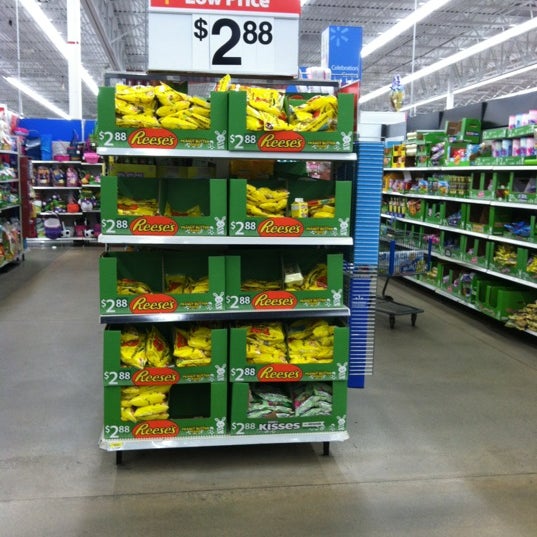
Locate an element on the screen. silver and brown object on top shelf is located at coordinates (395, 90).